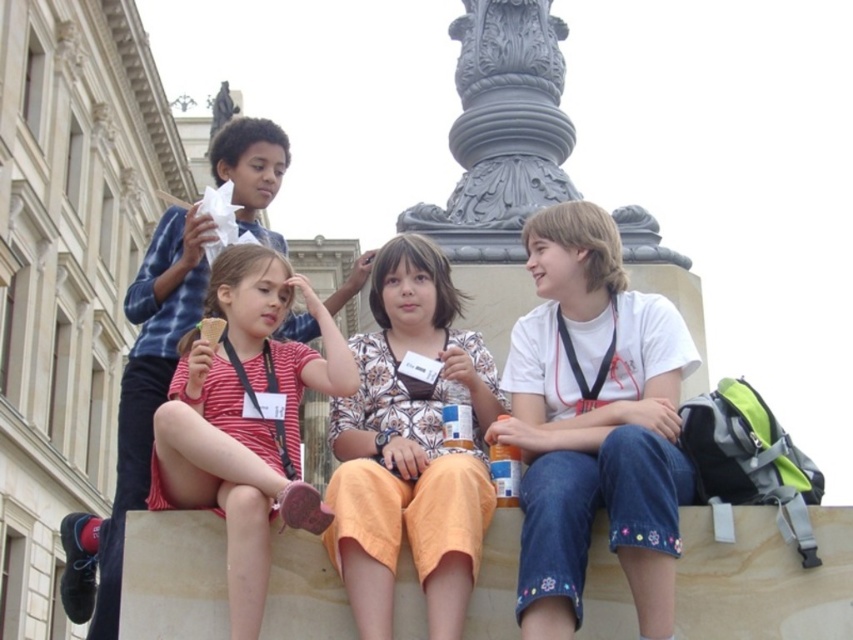
In the scene of four children sitting on a stone ledge in front of a classical building, you notice two shirts at the center. The shirts are labeled as white cotton shirt at center and striped cotton shirt at center. Which shirt is positioned higher relative to the other?

The white cotton shirt at center is located above the striped cotton shirt at center.